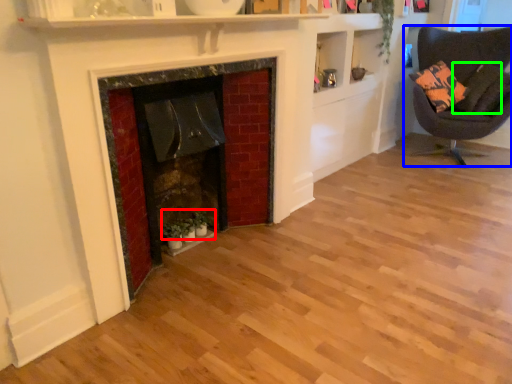
Question: Considering the real-world distances, which object is farthest from plant (highlighted by a red box)? chair (highlighted by a blue box) or pillow (highlighted by a green box)?

Choices:
 (A) chair
 (B) pillow

Answer: (A)